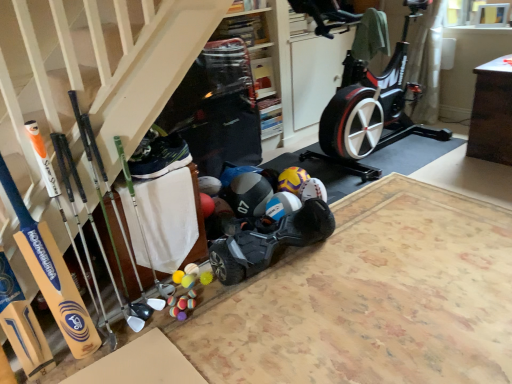
Question: Does blue matte helmet at center appear on the right side of black fabric shoe at center?

Choices:
 (A) yes
 (B) no

Answer: (A)

Question: Can you confirm if blue matte helmet at center is bigger than black fabric shoe at center?

Choices:
 (A) no
 (B) yes

Answer: (B)

Question: Is blue matte helmet at center next to black fabric shoe at center and touching it?

Choices:
 (A) no
 (B) yes

Answer: (A)

Question: From a real-world perspective, does blue matte helmet at center stand above black fabric shoe at center?

Choices:
 (A) no
 (B) yes

Answer: (A)

Question: Does blue matte helmet at center contain black fabric shoe at center?

Choices:
 (A) no
 (B) yes

Answer: (A)

Question: Considering the relative sizes of blue matte helmet at center and black fabric shoe at center in the image provided, is blue matte helmet at center thinner than black fabric shoe at center?

Choices:
 (A) no
 (B) yes

Answer: (A)

Question: Does black fabric shoe at center appear on the left side of wooden stairs at lower left?

Choices:
 (A) yes
 (B) no

Answer: (A)

Question: Is black fabric shoe at center behind wooden stairs at lower left?

Choices:
 (A) no
 (B) yes

Answer: (B)

Question: Considering the relative sizes of black fabric shoe at center and wooden stairs at lower left in the image provided, is black fabric shoe at center shorter than wooden stairs at lower left?

Choices:
 (A) no
 (B) yes

Answer: (B)

Question: Is black fabric shoe at center smaller than wooden stairs at lower left?

Choices:
 (A) no
 (B) yes

Answer: (B)

Question: From the image's perspective, does black fabric shoe at center appear higher than wooden stairs at lower left?

Choices:
 (A) no
 (B) yes

Answer: (A)

Question: Are black fabric shoe at center and wooden stairs at lower left far apart?

Choices:
 (A) yes
 (B) no

Answer: (B)

Question: Is black matte hoverboard at center touching wooden stairs at lower left?

Choices:
 (A) no
 (B) yes

Answer: (A)